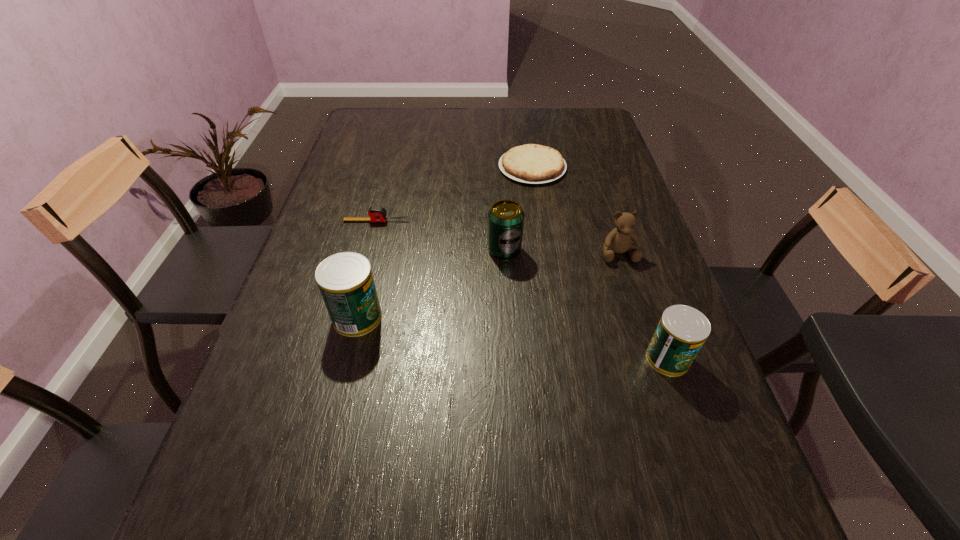
The width and height of the screenshot is (960, 540). What are the coordinates of `the farther can` in the screenshot? It's located at (345, 280).

Where is `the second nearest object`? The image size is (960, 540). the second nearest object is located at coordinates [x=345, y=280].

At what (x,y) coordinates should I click in order to perform the action: click on the nearer can. Please return your answer as a coordinate pair (x, y). The height and width of the screenshot is (540, 960). Looking at the image, I should click on click(682, 330).

Find the location of a particular element. The height and width of the screenshot is (540, 960). the shorter can is located at coordinates (682, 330).

Locate an element on the screen. the shortest object is located at coordinates point(535,164).

Find the location of `the farthest object`. the farthest object is located at coordinates (535, 164).

You are a GUI agent. You are given a task and a screenshot of the screen. Output one action in this format:
    pyautogui.click(x=<x>, y=<y>)
    Task: Click on the teddy bear
    
    Given the screenshot: What is the action you would take?
    pyautogui.click(x=618, y=240)

This screenshot has width=960, height=540. Find the location of `the fifth nearest object`. the fifth nearest object is located at coordinates (377, 214).

Find the location of `tape measure`. tape measure is located at coordinates (377, 214).

Where is `beer can`? This screenshot has height=540, width=960. beer can is located at coordinates (506, 217).